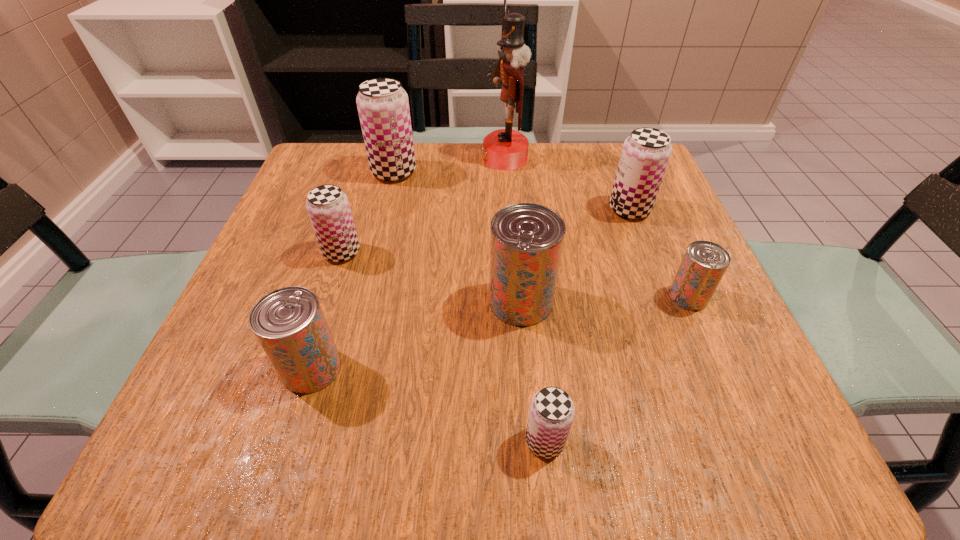
At what (x,y) coordinates should I click in order to perform the action: click on the tallest object. Please return your answer as a coordinate pair (x, y). Looking at the image, I should click on (505, 149).

Where is `red nutcracker`? The width and height of the screenshot is (960, 540). red nutcracker is located at coordinates pyautogui.click(x=505, y=149).

The height and width of the screenshot is (540, 960). I want to click on the farthest beer can, so click(383, 106).

Image resolution: width=960 pixels, height=540 pixels. I want to click on the farthest purple beer can, so click(x=383, y=106).

At what (x,y) coordinates should I click in order to perform the action: click on the second farthest purple beer can. Please return your answer as a coordinate pair (x, y). Looking at the image, I should click on (646, 152).

This screenshot has height=540, width=960. Identify the location of the rightmost purple beer can. (646, 152).

The height and width of the screenshot is (540, 960). What are the coordinates of `the second red beer can from left to right` in the screenshot? It's located at (526, 241).

Identify the location of the sixth farthest beer can. This screenshot has height=540, width=960. (289, 323).

Where is `the nearest red beer can`? The width and height of the screenshot is (960, 540). the nearest red beer can is located at coordinates (289, 323).

This screenshot has height=540, width=960. I want to click on the third farthest beer can, so click(328, 207).